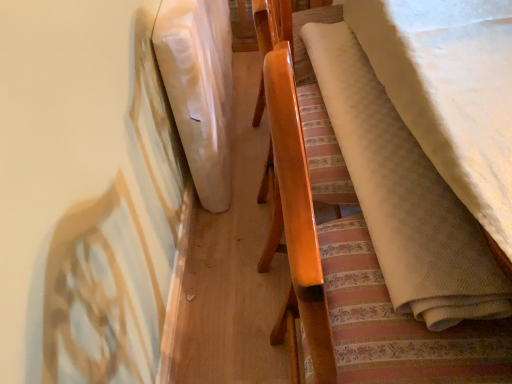
Question: Can you confirm if matte wood chair at center is shorter than white fabric at upper left?

Choices:
 (A) no
 (B) yes

Answer: (A)

Question: Is matte wood chair at center taller than white fabric at upper left?

Choices:
 (A) no
 (B) yes

Answer: (B)

Question: Is matte wood chair at center positioned far away from white fabric at upper left?

Choices:
 (A) yes
 (B) no

Answer: (B)

Question: Can you confirm if matte wood chair at center is wider than white fabric at upper left?

Choices:
 (A) no
 (B) yes

Answer: (B)

Question: Does matte wood chair at center have a smaller size compared to white fabric at upper left?

Choices:
 (A) no
 (B) yes

Answer: (A)

Question: Would you say matte wood chair at center is outside white fabric at upper left?

Choices:
 (A) no
 (B) yes

Answer: (B)

Question: Is white fabric at upper left not inside matte wood chair at center?

Choices:
 (A) no
 (B) yes

Answer: (B)

Question: Considering the relative sizes of white fabric at upper left and matte wood chair at center in the image provided, is white fabric at upper left smaller than matte wood chair at center?

Choices:
 (A) yes
 (B) no

Answer: (A)

Question: Is white fabric at upper left next to matte wood chair at center?

Choices:
 (A) no
 (B) yes

Answer: (A)

Question: Is white fabric at upper left thinner than matte wood chair at center?

Choices:
 (A) no
 (B) yes

Answer: (B)

Question: Does white fabric at upper left appear on the right side of matte wood chair at center?

Choices:
 (A) no
 (B) yes

Answer: (A)

Question: From a real-world perspective, is white fabric at upper left under matte wood chair at center?

Choices:
 (A) no
 (B) yes

Answer: (B)

Question: Would you say white fabric at upper left is inside or outside matte wood chair at center?

Choices:
 (A) outside
 (B) inside

Answer: (A)